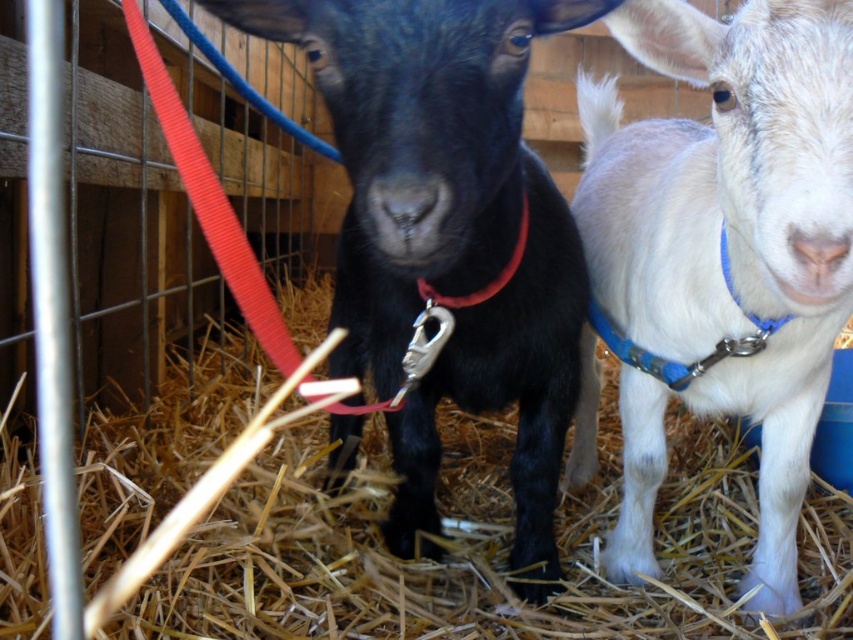
You are a farmer checking the barn. You notice the shiny black goat at center and the matte red collar at center. Which object is positioned to the right?

The matte red collar at center is positioned to the right of the shiny black goat at center.

You are a farmer checking the barn. You see the straw at center and the matte red collar at center. Which object is wider?

The straw at center is wider than the matte red collar at center.

You are a farmer who needs to replace the straw at center and the matte red collar at center. You have a limited budget and can only choose one item to replace. Based on their sizes, which item should you prioritize replacing first?

The straw at center is larger in size than the matte red collar at center, so you should prioritize replacing the straw at center first since it requires more material and may be more urgent due to its size.